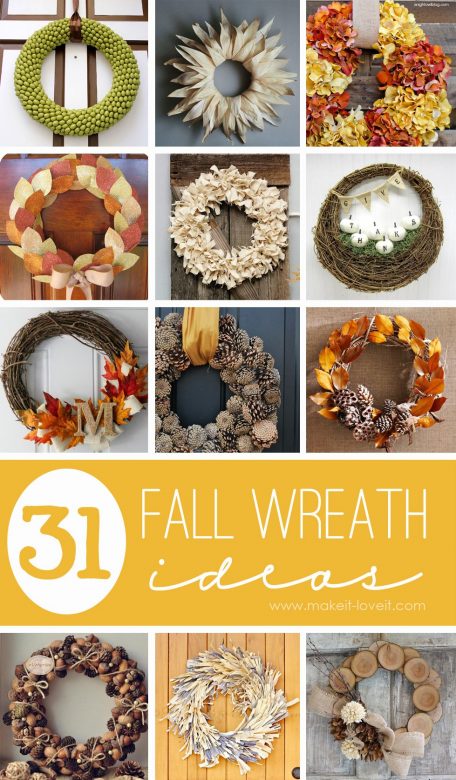
Where is `wreath hanger`? The height and width of the screenshot is (780, 456). wreath hanger is located at coordinates (76, 27).